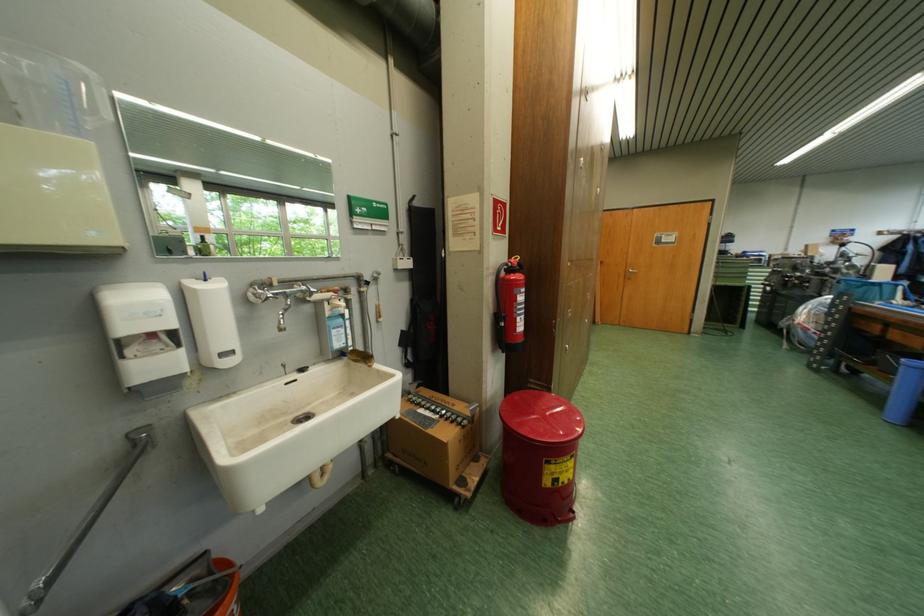
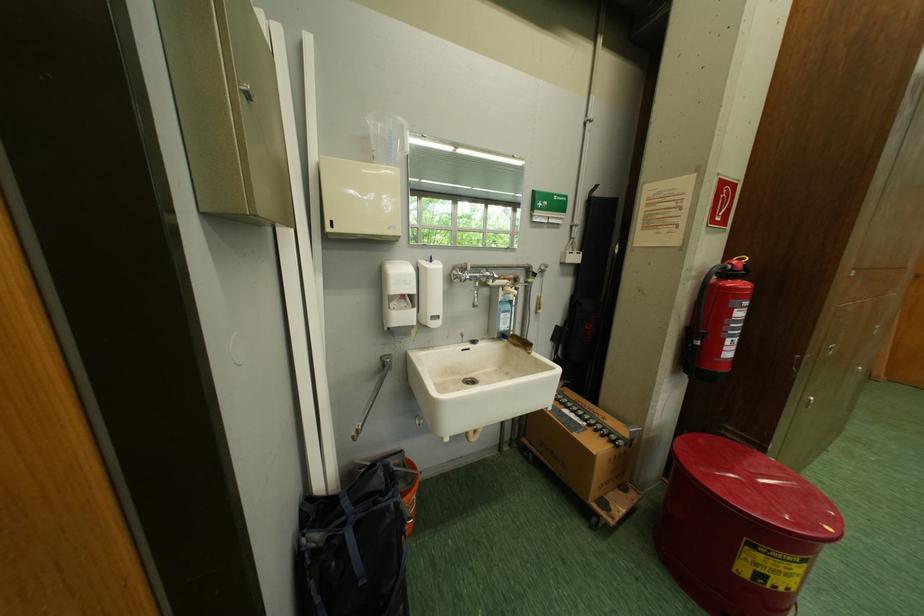
In the second image, find the point that corresponds to [140,391] in the first image.

(399, 331)